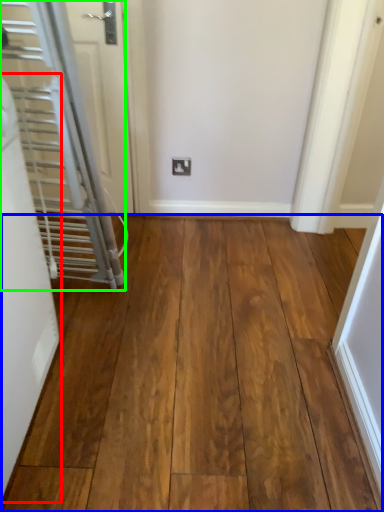
Question: Considering the real-world distances, which object is closest to door (highlighted by a red box)? hardwood (highlighted by a blue box) or door (highlighted by a green box).

Choices:
 (A) hardwood
 (B) door

Answer: (B)